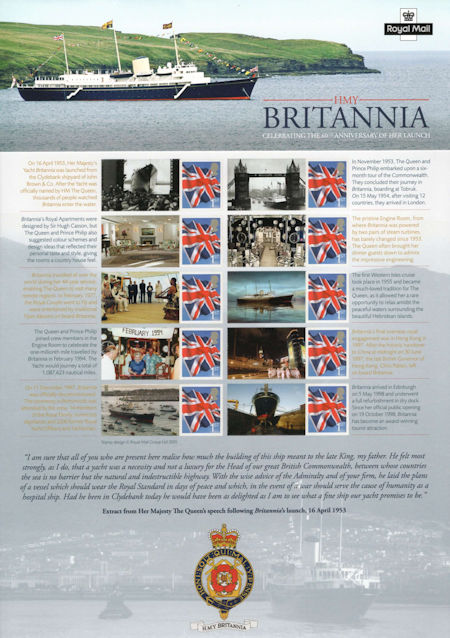
The width and height of the screenshot is (450, 638). I want to click on fireplace, so click(x=146, y=240).